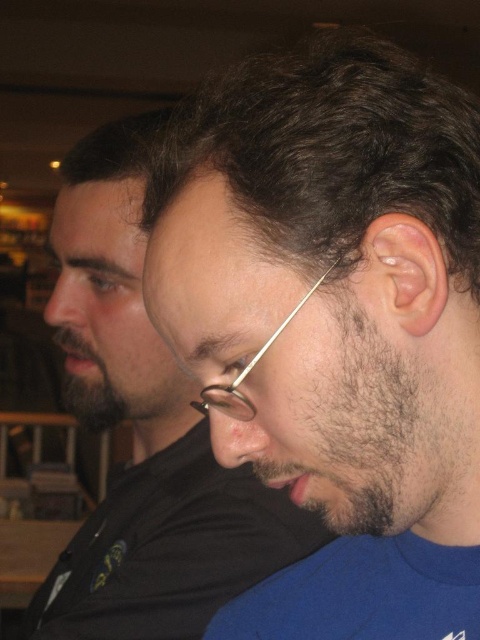
Question: Considering the real-world distances, which object is farthest from the dark blue fabric shirt at center?

Choices:
 (A) metallic wire-rimmed glasses at center
 (B) matte black glasses at center

Answer: (B)

Question: Among these points, which one is farthest from the camera?

Choices:
 (A) (348, 38)
 (B) (242, 419)

Answer: (A)

Question: Can you confirm if matte black glasses at center is positioned to the left of metallic wire-rimmed glasses at center?

Choices:
 (A) no
 (B) yes

Answer: (B)

Question: Which of these objects is positioned closest to the matte black glasses at center?

Choices:
 (A) metallic wire-rimmed glasses at center
 (B) dark blue fabric shirt at center

Answer: (B)

Question: Where is dark blue fabric shirt at center located in relation to metallic wire-rimmed glasses at center in the image?

Choices:
 (A) below
 (B) above

Answer: (B)

Question: Is dark blue fabric shirt at center above matte black glasses at center?

Choices:
 (A) yes
 (B) no

Answer: (A)